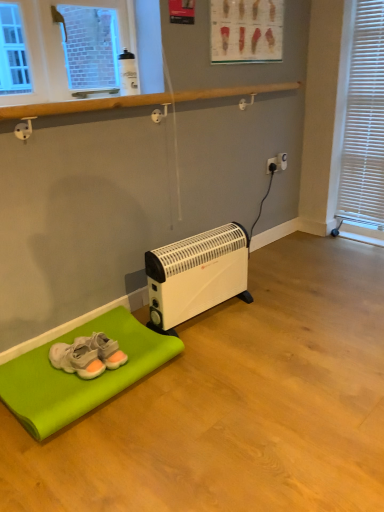
Image resolution: width=384 pixels, height=512 pixels. Identify the location of vacant space underneath white plastic heater at lower center (from a real-world perspective). (215, 316).